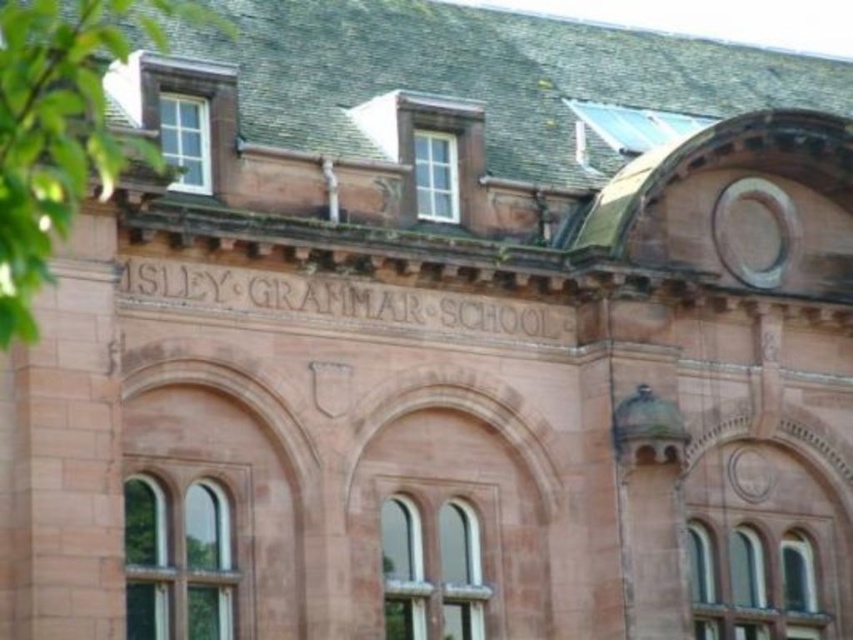
Question: Which point is closer to the camera taking this photo?

Choices:
 (A) (196, 128)
 (B) (440, 198)

Answer: (A)

Question: Is green leafy tree at left below white wood window at upper center?

Choices:
 (A) yes
 (B) no

Answer: (B)

Question: Which of the following is the farthest from the observer?

Choices:
 (A) matte brown window at upper center
 (B) matte brown window at center
 (C) matte glass window at center

Answer: (A)

Question: Does green leafy tree at left appear over matte brown window at upper center?

Choices:
 (A) yes
 (B) no

Answer: (A)

Question: Which point is farther to the camera?

Choices:
 (A) (476, 545)
 (B) (186, 547)
 (C) (708, 577)
 (D) (416, 134)

Answer: (C)

Question: In this image, where is white wood window at upper center located relative to matte brown window at upper center?

Choices:
 (A) left
 (B) right

Answer: (A)